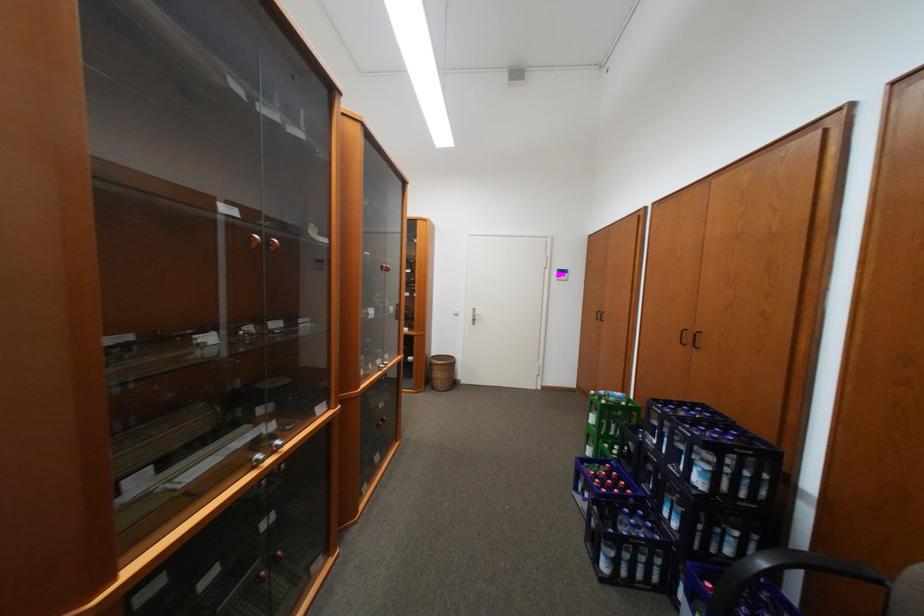
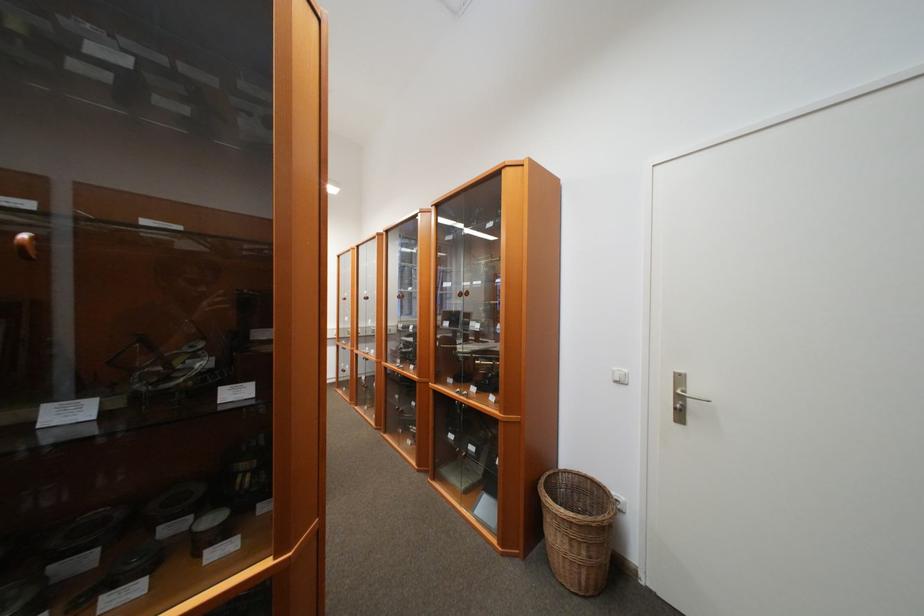
Locate, in the second image, the point that corresponds to (x=465, y=315) in the first image.

(626, 383)